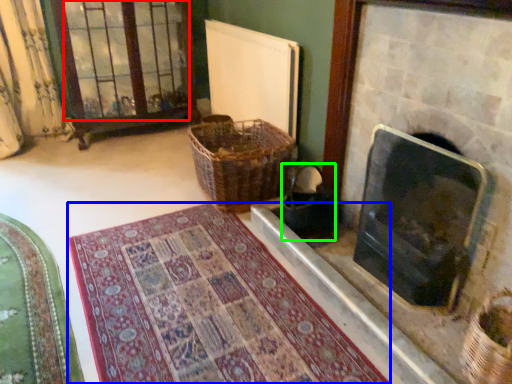
Question: Estimate the real-world distances between objects in this image. Which object is farther from glass door (highlighted by a red box), mat (highlighted by a blue box) or laundry basket (highlighted by a green box)?

Choices:
 (A) mat
 (B) laundry basket

Answer: (A)